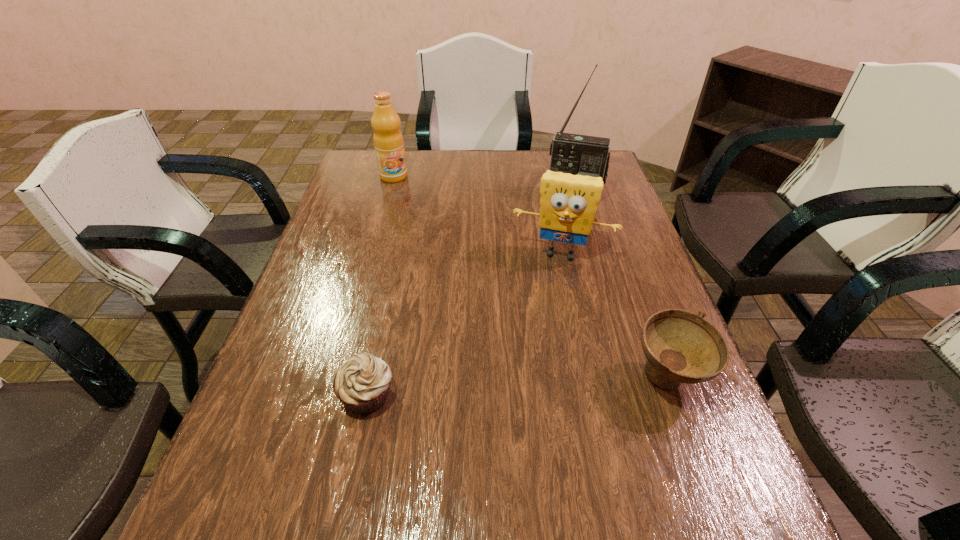
I want to click on object located at the left edge, so click(x=388, y=141).

Locate an element on the screen. soup bowl located at the right edge is located at coordinates (681, 346).

The image size is (960, 540). I want to click on radio receiver that is at the right edge, so click(x=576, y=154).

The height and width of the screenshot is (540, 960). What are the coordinates of `sponge that is at the right edge` in the screenshot? It's located at (568, 202).

The width and height of the screenshot is (960, 540). I want to click on object that is at the far left corner, so click(x=388, y=141).

In the image, there is a desktop. Identify the location of vacant space at the far edge. This screenshot has width=960, height=540. (493, 161).

The width and height of the screenshot is (960, 540). I want to click on free space at the near edge of the desktop, so click(x=374, y=472).

At what (x,y) coordinates should I click in order to perform the action: click on free space at the left edge of the desktop. Please return your answer as a coordinate pair (x, y). The width and height of the screenshot is (960, 540). Looking at the image, I should click on (329, 278).

Find the location of a particular element. vacant point at the right edge is located at coordinates (657, 289).

In the image, there is a desktop. Find the location of `vacant space at the near right corner`. vacant space at the near right corner is located at coordinates (684, 435).